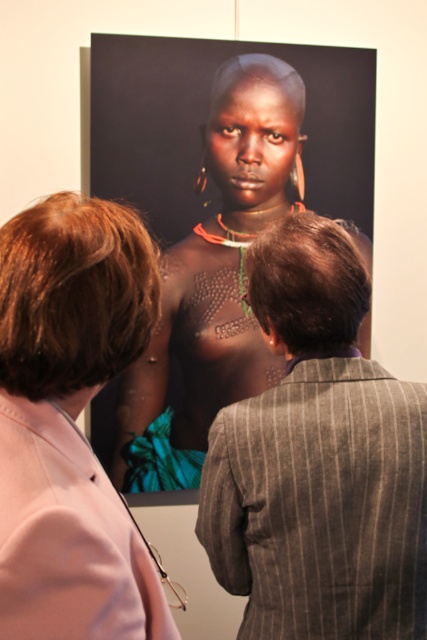
Who is positioned more to the right, gray pinstripe suit at center or pink fabric at upper left?

From the viewer's perspective, gray pinstripe suit at center appears more on the right side.

Which is more to the left, gray pinstripe suit at center or pink fabric at upper left?

pink fabric at upper left

Between point (283, 336) and point (40, 451), which one is positioned behind?

Point (283, 336)

At what (x,y) coordinates should I click in order to perform the action: click on gray pinstripe suit at center. Please return your answer as a coordinate pair (x, y). The image size is (427, 640). Looking at the image, I should click on [x=318, y=460].

Is pink fabric at upper left positioned before matte black skin at center?

Yes, pink fabric at upper left is closer to the viewer.

Identify the location of pink fabric at upper left. (67, 422).

Find the location of a particular element. This screenshot has width=427, height=640. pink fabric at upper left is located at coordinates (67, 422).

Find the location of a particular element. pink fabric at upper left is located at coordinates (67, 422).

Where is `gray pinstripe suit at center`? This screenshot has width=427, height=640. gray pinstripe suit at center is located at coordinates (318, 460).

Can you confirm if gray pinstripe suit at center is positioned to the right of matte black skin at center?

Correct, you'll find gray pinstripe suit at center to the right of matte black skin at center.

Locate an element on the screen. Image resolution: width=427 pixels, height=640 pixels. gray pinstripe suit at center is located at coordinates pyautogui.click(x=318, y=460).

At what (x,y) coordinates should I click in order to perform the action: click on gray pinstripe suit at center. Please return your answer as a coordinate pair (x, y). Looking at the image, I should click on (318, 460).